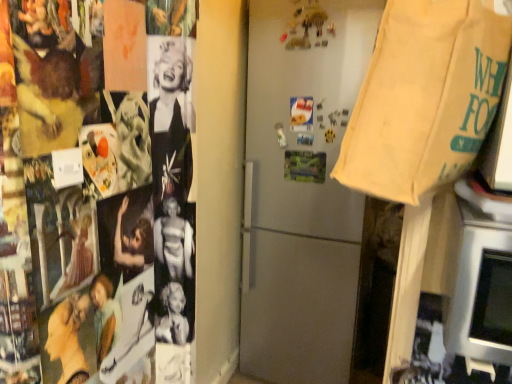
Question: Is satin silver refrigerator at center directly adjacent to silver metallic oven at lower right?

Choices:
 (A) no
 (B) yes

Answer: (A)

Question: From the image's perspective, is satin silver refrigerator at center over silver metallic oven at lower right?

Choices:
 (A) no
 (B) yes

Answer: (B)

Question: Considering the relative sizes of satin silver refrigerator at center and silver metallic oven at lower right in the image provided, is satin silver refrigerator at center bigger than silver metallic oven at lower right?

Choices:
 (A) no
 (B) yes

Answer: (B)

Question: From a real-world perspective, does satin silver refrigerator at center stand above silver metallic oven at lower right?

Choices:
 (A) no
 (B) yes

Answer: (A)

Question: Can you confirm if satin silver refrigerator at center is taller than silver metallic oven at lower right?

Choices:
 (A) yes
 (B) no

Answer: (A)

Question: From a real-world perspective, is silver metallic oven at lower right above or below beige canvas grocery bag at upper right?

Choices:
 (A) below
 (B) above

Answer: (A)

Question: From their relative heights in the image, would you say silver metallic oven at lower right is taller or shorter than beige canvas grocery bag at upper right?

Choices:
 (A) tall
 (B) short

Answer: (B)

Question: Is silver metallic oven at lower right spatially inside beige canvas grocery bag at upper right, or outside of it?

Choices:
 (A) inside
 (B) outside

Answer: (B)

Question: Does point (466, 349) appear closer or farther from the camera than point (439, 137)?

Choices:
 (A) farther
 (B) closer

Answer: (A)

Question: From a real-world perspective, is beige canvas grocery bag at upper right positioned above or below silver metallic oven at lower right?

Choices:
 (A) above
 (B) below

Answer: (A)

Question: In the image, is beige canvas grocery bag at upper right positioned in front of or behind silver metallic oven at lower right?

Choices:
 (A) behind
 (B) front

Answer: (B)

Question: In terms of size, does beige canvas grocery bag at upper right appear bigger or smaller than silver metallic oven at lower right?

Choices:
 (A) small
 (B) big

Answer: (B)

Question: Is beige canvas grocery bag at upper right to the left or to the right of silver metallic oven at lower right in the image?

Choices:
 (A) right
 (B) left

Answer: (B)

Question: Is satin silver refrigerator at center to the left or to the right of silver metallic oven at lower right in the image?

Choices:
 (A) right
 (B) left

Answer: (B)

Question: Is satin silver refrigerator at center inside or outside of silver metallic oven at lower right?

Choices:
 (A) inside
 (B) outside

Answer: (B)